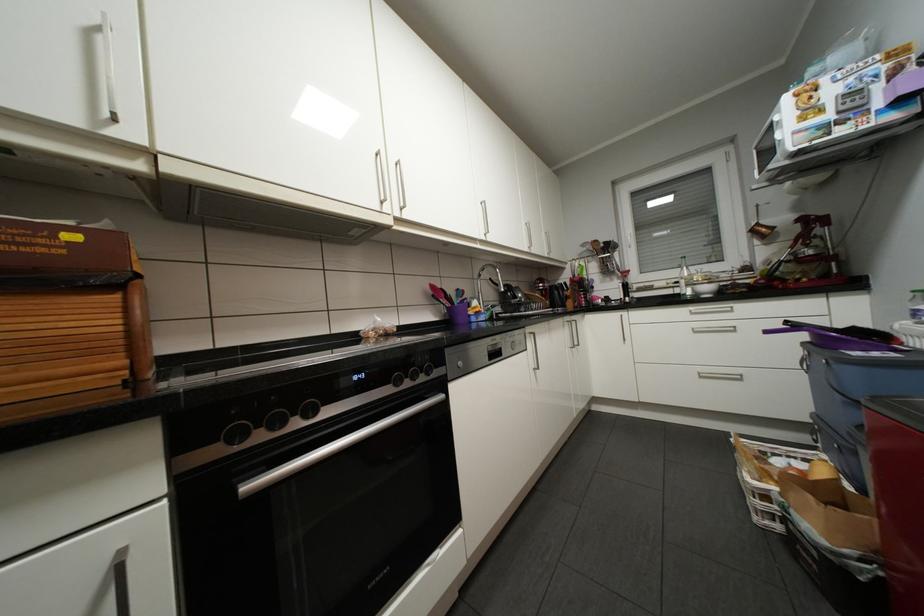
Locate an element on the screen. The width and height of the screenshot is (924, 616). purple dustpan handle is located at coordinates (782, 333).